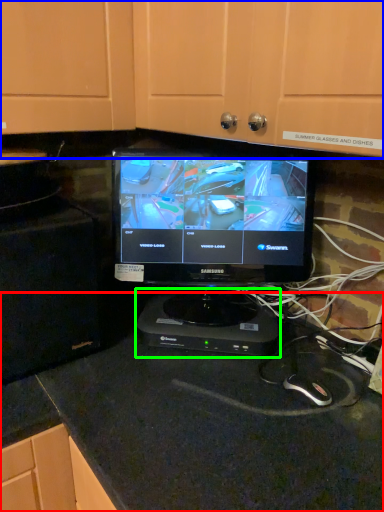
Question: Considering the real-world distances, which object is closest to counter top (highlighted by a red box)? dresser (highlighted by a blue box) or appliance (highlighted by a green box).

Choices:
 (A) dresser
 (B) appliance

Answer: (B)